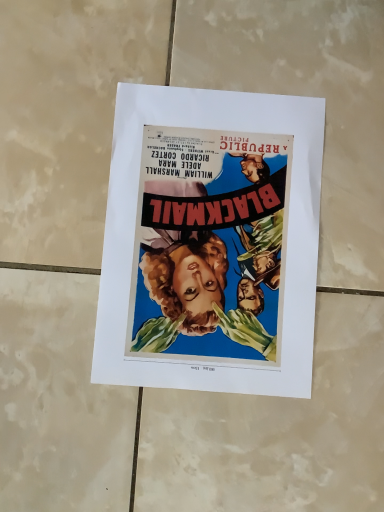
This screenshot has width=384, height=512. What do you see at coordinates (211, 242) in the screenshot? I see `matte paper poster at center` at bounding box center [211, 242].

You are a GUI agent. You are given a task and a screenshot of the screen. Output one action in this format:
    pyautogui.click(x=<x>, y=<y>)
    Task: Click on the matte paper poster at center
    Image resolution: width=384 pixels, height=512 pixels.
    Given the screenshot: What is the action you would take?
    pyautogui.click(x=211, y=242)

This screenshot has width=384, height=512. I want to click on matte paper poster at center, so click(x=211, y=242).